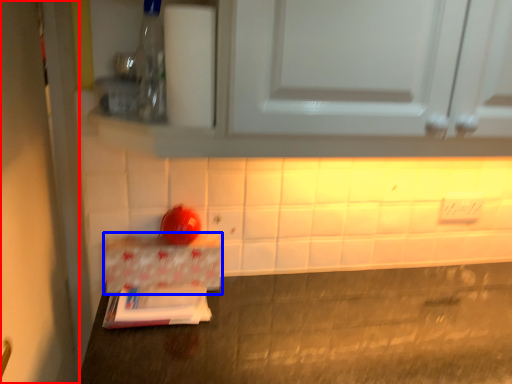
Question: Which point is further to the camera, door (highlighted by a red box) or cardboard box (highlighted by a blue box)?

Choices:
 (A) door
 (B) cardboard box

Answer: (B)